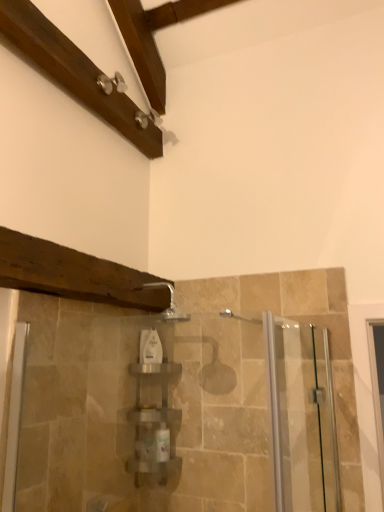
Question: Is silver metallic faucet at upper center beside white glossy bottle at center?

Choices:
 (A) no
 (B) yes

Answer: (A)

Question: Does silver metallic faucet at upper center appear on the left side of white glossy bottle at center?

Choices:
 (A) yes
 (B) no

Answer: (B)

Question: Is silver metallic faucet at upper center facing away from white glossy bottle at center?

Choices:
 (A) yes
 (B) no

Answer: (B)

Question: From the image's perspective, is silver metallic faucet at upper center below white glossy bottle at center?

Choices:
 (A) yes
 (B) no

Answer: (B)

Question: Considering the relative positions of silver metallic faucet at upper center and white glossy bottle at center in the image provided, is silver metallic faucet at upper center to the right of white glossy bottle at center from the viewer's perspective?

Choices:
 (A) no
 (B) yes

Answer: (B)

Question: Is white glossy bottle at center to the left or to the right of clear plastic shelf at center in the image?

Choices:
 (A) left
 (B) right

Answer: (A)

Question: From the image's perspective, relative to clear plastic shelf at center, is white glossy bottle at center above or below?

Choices:
 (A) above
 (B) below

Answer: (A)

Question: Is white glossy bottle at center wider or thinner than clear plastic shelf at center?

Choices:
 (A) thin
 (B) wide

Answer: (A)

Question: Do you think white glossy bottle at center is within clear plastic shelf at center, or outside of it?

Choices:
 (A) outside
 (B) inside

Answer: (A)

Question: In the image, is clear glass screen door at right positioned in front of or behind clear plastic shelf at center?

Choices:
 (A) behind
 (B) front

Answer: (B)

Question: Based on their sizes in the image, would you say clear glass screen door at right is bigger or smaller than clear plastic shelf at center?

Choices:
 (A) small
 (B) big

Answer: (B)

Question: Considering the positions of clear glass screen door at right and clear plastic shelf at center in the image, is clear glass screen door at right wider or thinner than clear plastic shelf at center?

Choices:
 (A) thin
 (B) wide

Answer: (A)

Question: Is point (304, 381) positioned closer to the camera than point (170, 467)?

Choices:
 (A) farther
 (B) closer

Answer: (B)

Question: From their relative heights in the image, would you say silver metallic faucet at upper center is taller or shorter than clear plastic shelf at center?

Choices:
 (A) tall
 (B) short

Answer: (B)

Question: Is silver metallic faucet at upper center to the left or to the right of clear plastic shelf at center in the image?

Choices:
 (A) right
 (B) left

Answer: (A)